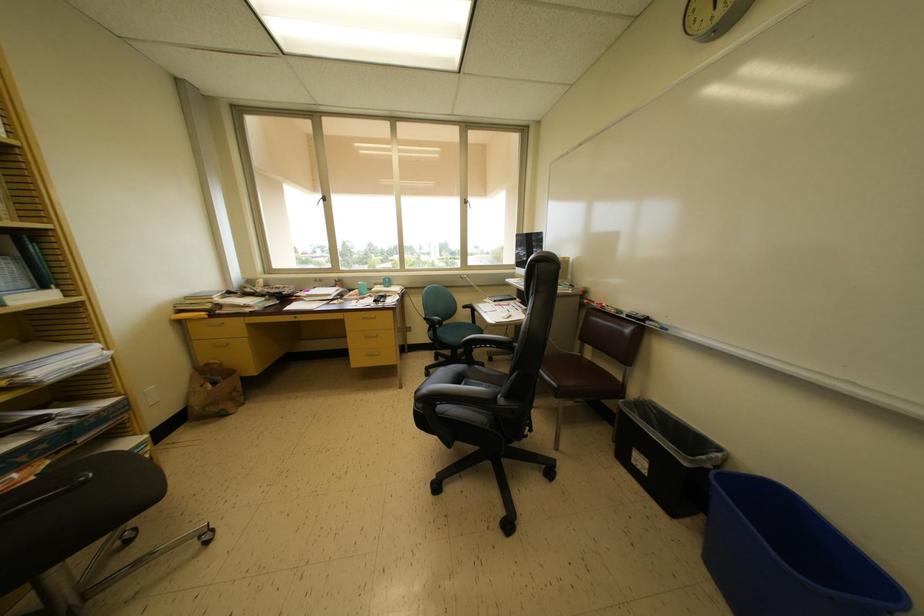
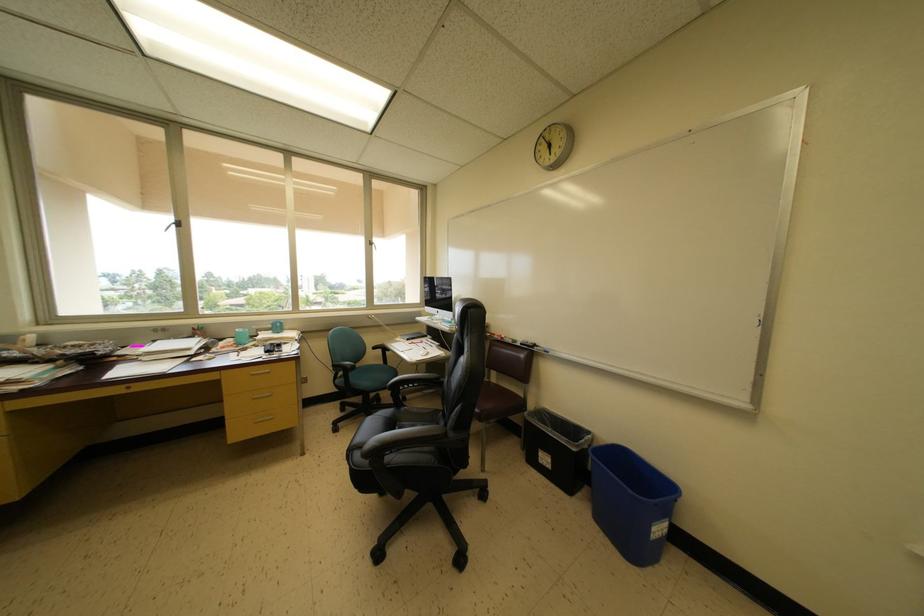
In the second image, find the point that corresponds to point (713, 471) in the first image.

(590, 451)